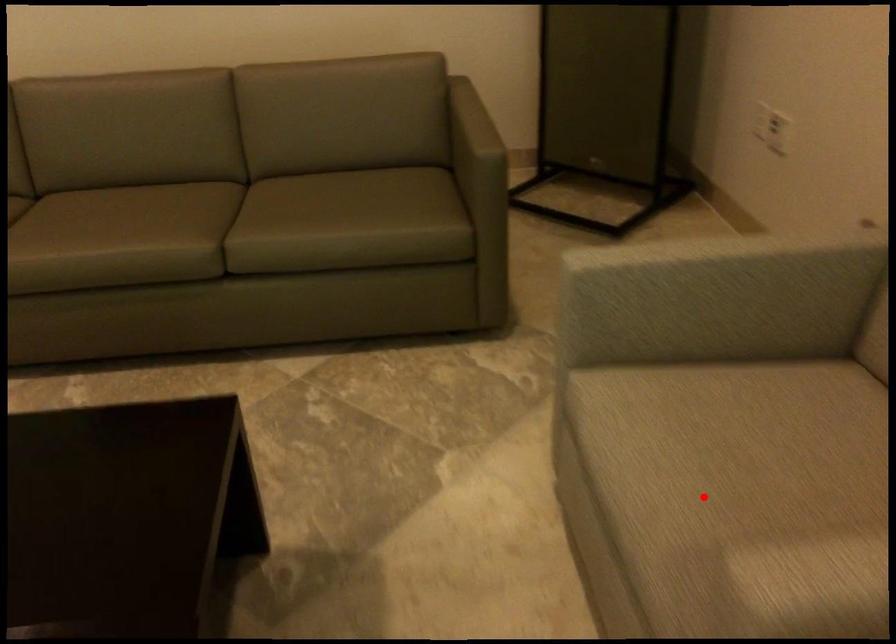
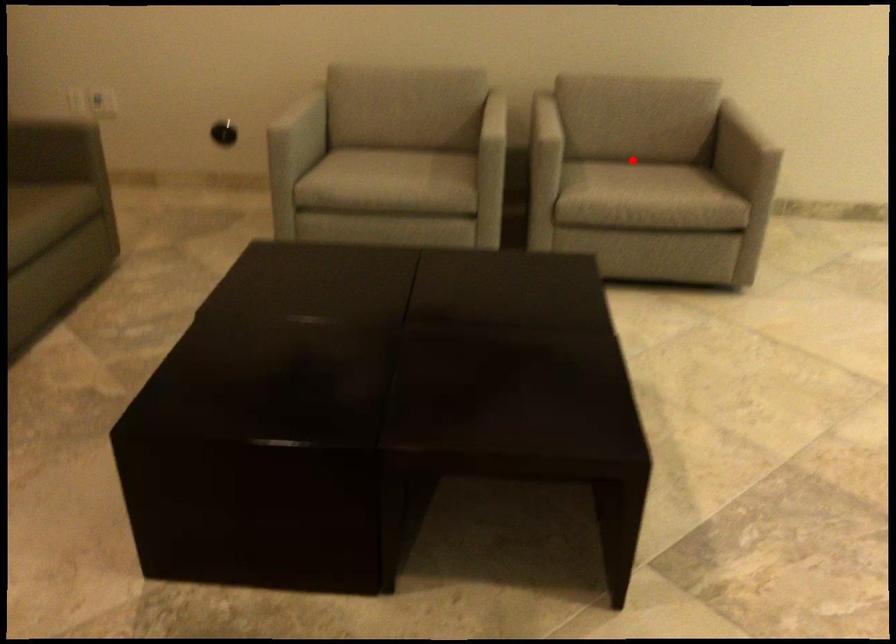
I am providing you with two images of the same scene from different viewpoints. A red point is marked on the first image and another point is marked on the second image. Does the point marked in image1 correspond to the same location as the one in image2?

No